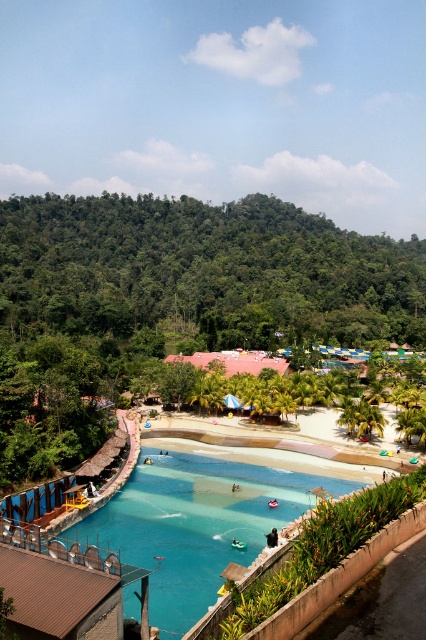
Question: Among these points, which one is nearest to the camera?

Choices:
 (A) click(x=46, y=195)
 (B) click(x=111, y=548)

Answer: (B)

Question: Is green leafy trees at upper left below blue glossy water at center?

Choices:
 (A) yes
 (B) no

Answer: (B)

Question: Which point is closer to the camera?

Choices:
 (A) (184, 504)
 (B) (147, 252)

Answer: (A)

Question: Which point is farther to the camera?

Choices:
 (A) (226, 298)
 (B) (181, 483)

Answer: (A)

Question: Is green leafy trees at upper left behind blue glossy water at center?

Choices:
 (A) yes
 (B) no

Answer: (A)

Question: Does green leafy trees at upper left appear on the right side of blue glossy water at center?

Choices:
 (A) yes
 (B) no

Answer: (B)